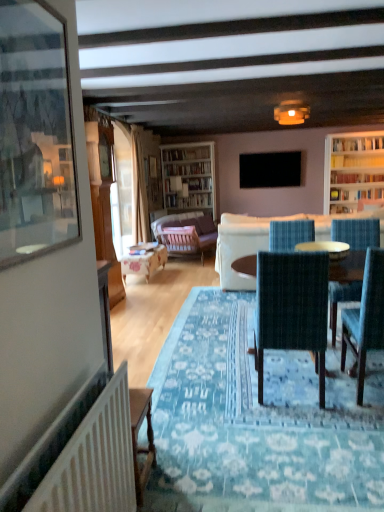
In order to click on vacant region to the right of wooden table at center in this screenshot , I will do (x=186, y=275).